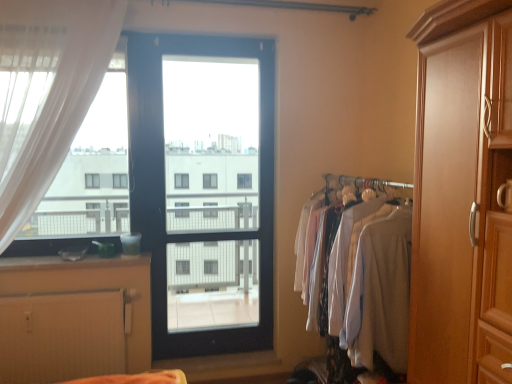
At what (x,y) coordinates should I click in order to perform the action: click on vacant space situated above smooth wooden surface at lower left (from a real-world perspective). Please return your answer as a coordinate pair (x, y). The height and width of the screenshot is (384, 512). Looking at the image, I should click on (98, 256).